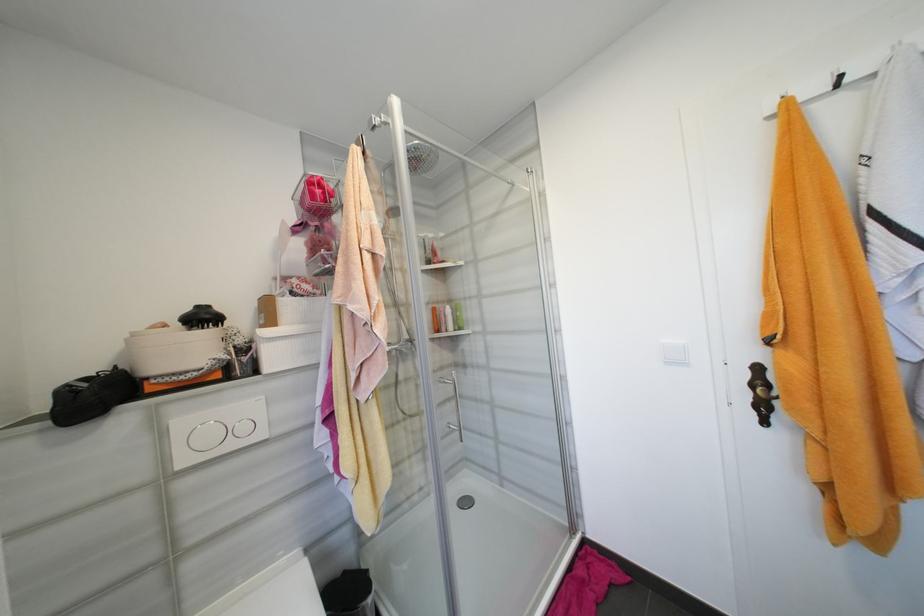
Image resolution: width=924 pixels, height=616 pixels. In order to click on black door handle in this screenshot , I will do `click(761, 394)`.